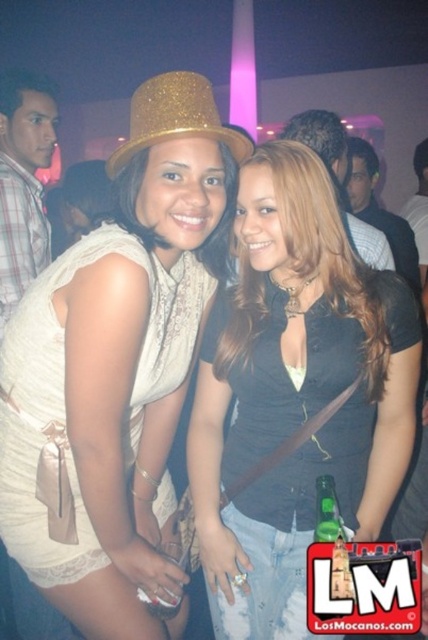
Question: Does matte gold glitter hat at center come behind matte black top at center?

Choices:
 (A) no
 (B) yes

Answer: (A)

Question: Which point is closer to the camera?

Choices:
 (A) gold glittery hat at center
 (B) matte black top at center

Answer: (A)

Question: Based on their relative distances, which object is nearer to the gold glittery hat at center?

Choices:
 (A) matte black top at center
 (B) matte gold glitter hat at center

Answer: (B)

Question: Which object appears closest to the camera in this image?

Choices:
 (A) matte gold glitter hat at center
 (B) gold glittery hat at center
 (C) matte black top at center

Answer: (A)

Question: Is matte black top at center above gold glittery hat at center?

Choices:
 (A) no
 (B) yes

Answer: (A)

Question: Does matte gold glitter hat at center lie in front of matte black top at center?

Choices:
 (A) yes
 (B) no

Answer: (A)